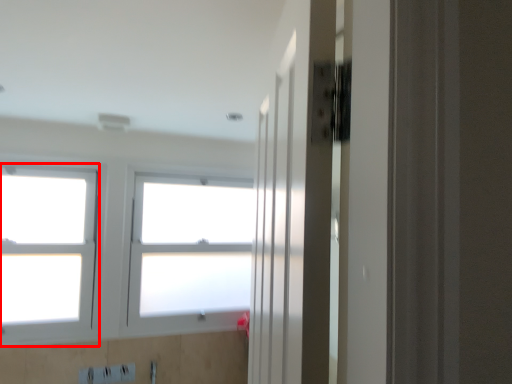
Question: Considering the relative positions of window (annotated by the red box) and window in the image provided, where is window (annotated by the red box) located with respect to the staircase?

Choices:
 (A) right
 (B) left

Answer: (B)